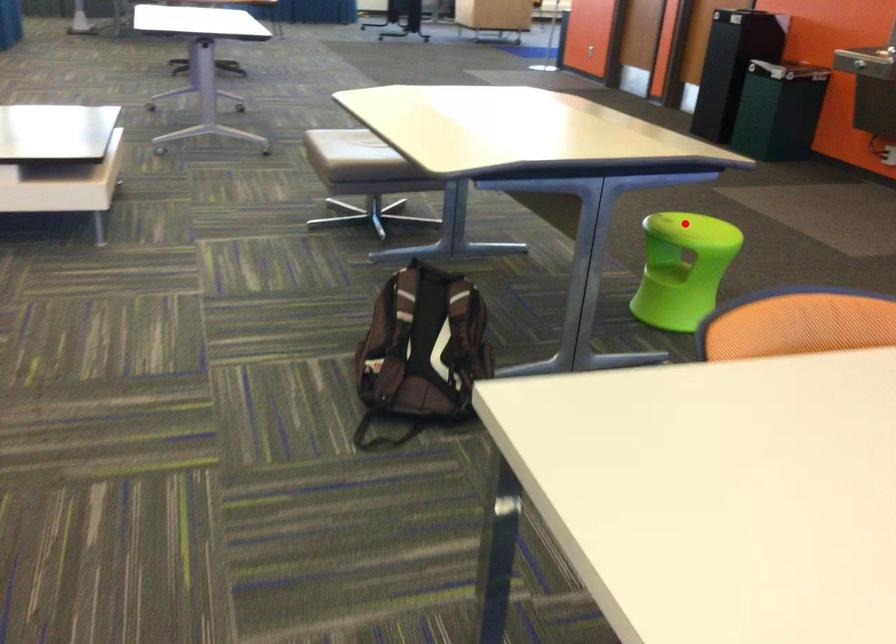
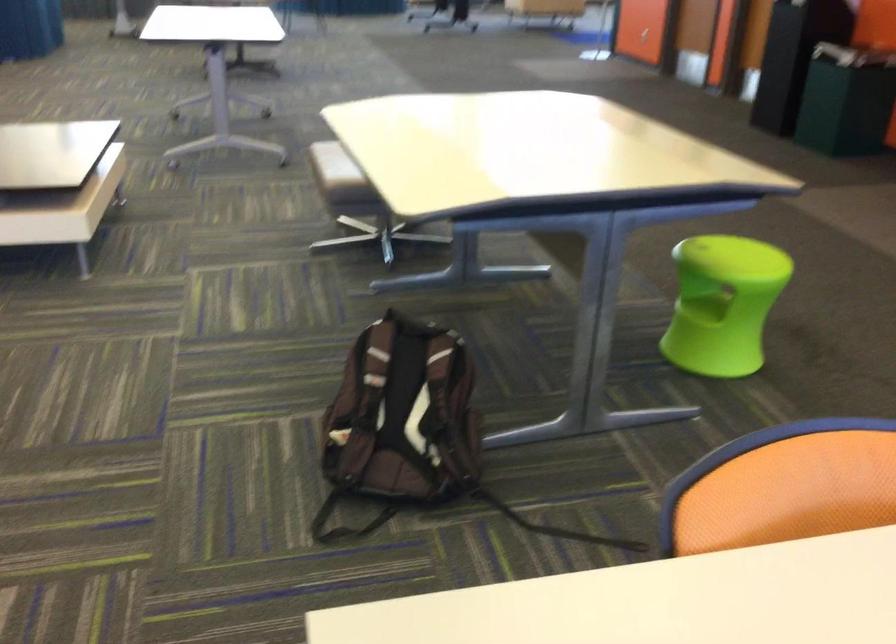
Question: I am providing you with two images of the same scene from different viewpoints. A red point is shown in image1. For the corresponding object point in image2, is it positioned nearer or farther from the camera?

Choices:
 (A) Nearer
 (B) Farther

Answer: (A)